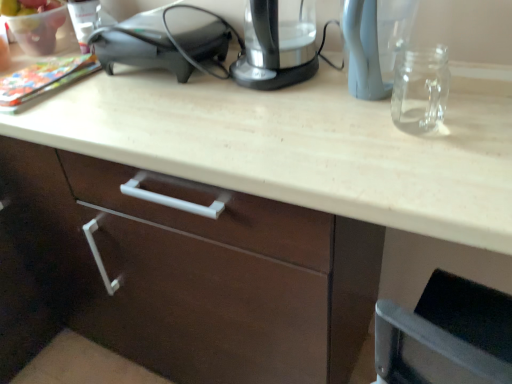
Question: Considering the relative positions of satin black speaker at upper left and transparent plastic kettle at upper center in the image provided, is satin black speaker at upper left to the left or to the right of transparent plastic kettle at upper center?

Choices:
 (A) left
 (B) right

Answer: (A)

Question: In terms of size, does satin black speaker at upper left appear bigger or smaller than transparent plastic kettle at upper center?

Choices:
 (A) small
 (B) big

Answer: (B)

Question: From a real-world perspective, is satin black speaker at upper left above or below transparent plastic kettle at upper center?

Choices:
 (A) below
 (B) above

Answer: (A)

Question: Relative to satin black speaker at upper left, is transparent plastic kettle at upper center in front or behind?

Choices:
 (A) behind
 (B) front

Answer: (B)

Question: From their relative heights in the image, would you say transparent plastic kettle at upper center is taller or shorter than satin black speaker at upper left?

Choices:
 (A) tall
 (B) short

Answer: (A)

Question: Considering the positions of transparent plastic kettle at upper center and satin black speaker at upper left in the image, is transparent plastic kettle at upper center wider or thinner than satin black speaker at upper left?

Choices:
 (A) wide
 (B) thin

Answer: (B)

Question: Visually, is transparent plastic kettle at upper center positioned to the left or to the right of satin black speaker at upper left?

Choices:
 (A) left
 (B) right

Answer: (B)